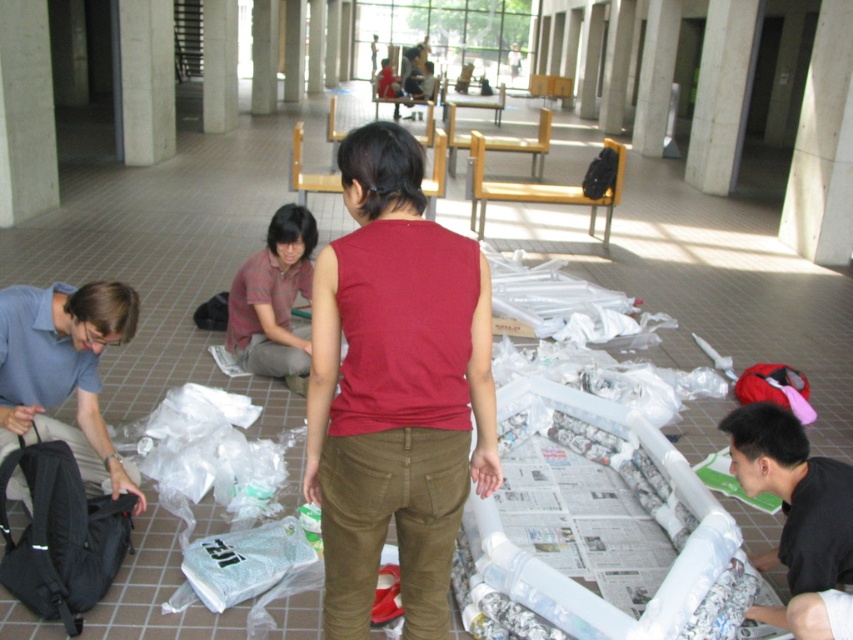
You are standing at point (x=613, y=168) and want to walk to point (x=26, y=4). According to the scene, which direction should you move?

Point (x=26, y=4) is in front of point (x=613, y=168), so you should move forward towards it.

You are a delivery person who needs to place a large package that is 2 meters wide. You see the concrete at left and the black matte backpack at center. Which object can the package fit next to without overlapping?

The concrete at left has a larger width than the black matte backpack at center, so the package can fit next to the concrete at left.